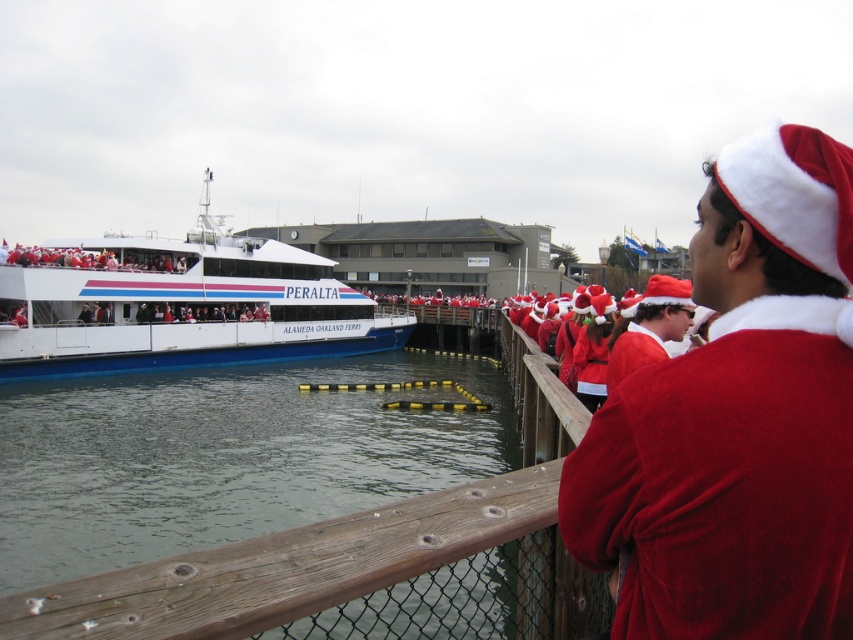
Question: Does velvet red santa hat at upper right have a lesser width compared to clear water at dock center?

Choices:
 (A) yes
 (B) no

Answer: (A)

Question: Is white glossy ferry at left wider than fuzzy red santa hat at center?

Choices:
 (A) no
 (B) yes

Answer: (B)

Question: Which is farther from the clear water at dock center?

Choices:
 (A) fuzzy red santa hat at center
 (B) white glossy ferry at left
 (C) velvet red santa hat at upper right

Answer: (C)

Question: Does clear water at dock center have a smaller size compared to white glossy ferry at left?

Choices:
 (A) no
 (B) yes

Answer: (B)

Question: Which object is positioned farthest from the white glossy ferry at left?

Choices:
 (A) velvet red santa hat at upper right
 (B) fuzzy red santa hat at center

Answer: (A)

Question: Estimate the real-world distances between objects in this image. Which object is closer to the fuzzy red santa hat at center?

Choices:
 (A) white glossy ferry at left
 (B) velvet red santa hat at upper right

Answer: (B)